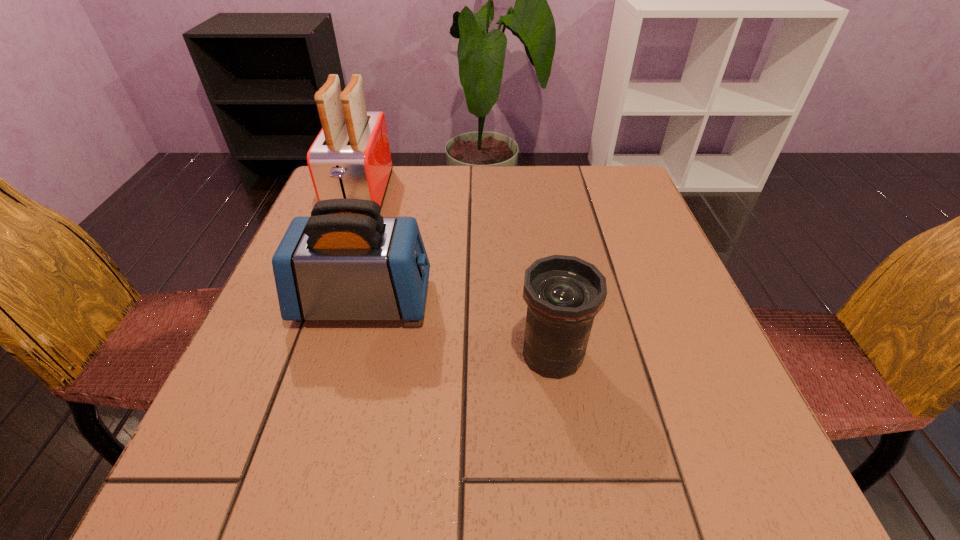
Identify the location of free space between the telephoto lens and the taller toaster. tap(456, 275).

Where is `empty space that is in between the telephoto lens and the shorter toaster`? The image size is (960, 540). empty space that is in between the telephoto lens and the shorter toaster is located at coordinates (458, 327).

I want to click on blank region between the tallest object and the rightmost object, so click(x=456, y=275).

Image resolution: width=960 pixels, height=540 pixels. I want to click on free space between the second shortest object and the telephoto lens, so click(458, 327).

The height and width of the screenshot is (540, 960). Identify the location of object that is the second nearest to the second shortest object. (563, 294).

Identify which object is located as the second nearest to the shorter toaster. Please provide its 2D coordinates. Your answer should be formatted as a tuple, i.e. [(x, y)], where the tuple contains the x and y coordinates of a point satisfying the conditions above.

[(563, 294)]

Locate an element on the screen. free region that satisfies the following two spatial constraints: 1. on the front-facing side of the farther toaster; 2. on the right side of the shortest object is located at coordinates (302, 354).

Where is `vacant space that satisfies the following two spatial constraints: 1. on the front-facing side of the shorter toaster; 2. on the right side of the shortest object`? Image resolution: width=960 pixels, height=540 pixels. vacant space that satisfies the following two spatial constraints: 1. on the front-facing side of the shorter toaster; 2. on the right side of the shortest object is located at coordinates (349, 354).

Locate an element on the screen. Image resolution: width=960 pixels, height=540 pixels. free space that satisfies the following two spatial constraints: 1. on the front-facing side of the shorter toaster; 2. on the back side of the telephoto lens is located at coordinates (349, 354).

Find the location of `blank space that satisfies the following two spatial constraints: 1. on the front-facing side of the shortest object; 2. on the left side of the farthest object`. blank space that satisfies the following two spatial constraints: 1. on the front-facing side of the shortest object; 2. on the left side of the farthest object is located at coordinates (302, 354).